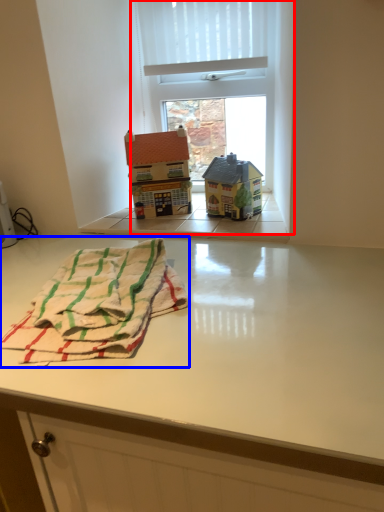
Question: Among these objects, which one is nearest to the camera, window (highlighted by a red box) or beach towel (highlighted by a blue box)?

Choices:
 (A) window
 (B) beach towel

Answer: (B)